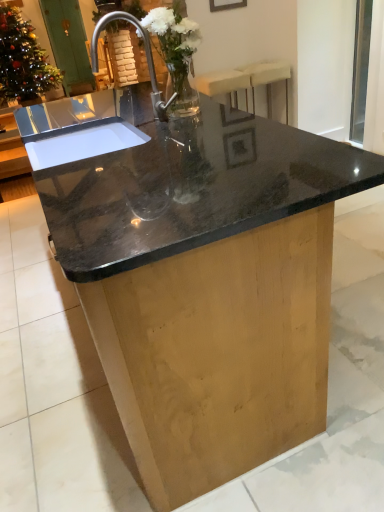
Question: From a real-world perspective, is translucent glass vase at upper left, placed as the 2th floral arrangement when sorted from front to back, above or below transparent glass window screen at upper right?

Choices:
 (A) above
 (B) below

Answer: (A)

Question: Relative to transparent glass window screen at upper right, is translucent glass vase at upper left, placed as the 2th floral arrangement when sorted from front to back, in front or behind?

Choices:
 (A) behind
 (B) front

Answer: (A)

Question: Estimate the real-world distances between objects in this image. Which object is closer to the polished stainless steel sink at center?

Choices:
 (A) beige fabric bar stool at upper right
 (B) matte black picture frame at upper center
 (C) translucent glass vase at upper left, which appears as the 1th floral arrangement when viewed from the top
 (D) clear glass vase at center, the second floral arrangement viewed from the top
 (E) transparent glass window screen at upper right

Answer: (D)

Question: Estimate the real-world distances between objects in this image. Which object is farther from the green wooden screen door at upper left?

Choices:
 (A) clear glass vase at center, positioned as the second floral arrangement in left-to-right order
 (B) translucent glass vase at upper left, placed as the 2th floral arrangement when sorted from front to back
 (C) matte black picture frame at upper center
 (D) polished stainless steel sink at center
 (E) beige fabric bar stool at upper right

Answer: (A)